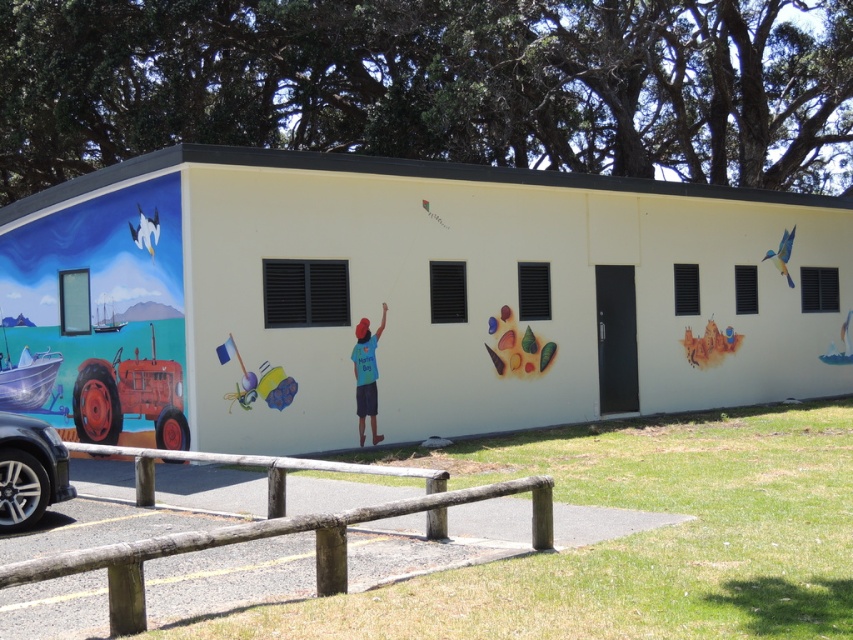
You are an artist planning to add a new element to the mural. You have a shiny golden star that you want to place above the glossy acrylic leaves at center. Where should you position it in relation to the matte yellow castle at center right?

The glossy acrylic leaves at center are located below the matte yellow castle at center right. To place the shiny golden star above the glossy acrylic leaves at center, you should position it between the glossy acrylic leaves at center and the matte yellow castle at center right.

You are standing in front of the building with the mural. You notice two points on the mural at coordinates point (279, 636) and point (13, 518). Which point is closer to your current position?

Point (279, 636) is closer to the camera than point (13, 518), so the point at (279, 636) is closer to your current position.